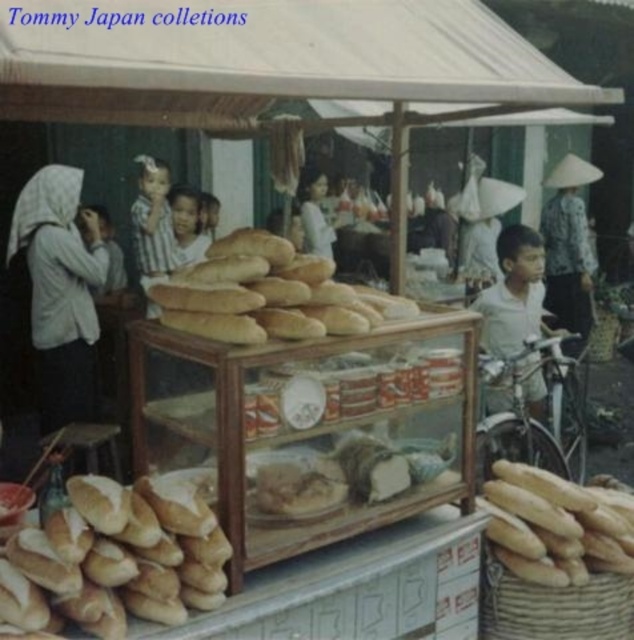
You are a customer at the bread stall and want to grab a baguette. Which one is easier to reach, the golden brown crusty baguette at lower left or the golden brown crusty baguettes at center?

The golden brown crusty baguette at lower left is closer to the viewer than the golden brown crusty baguettes at center, so it is easier to reach.

You are a fashion designer observing the Tommy Japan collections at the bread stall. You notice the white cloth headscarf at left and the white cotton shirt at center. Which item has a greater width?

The white cloth headscarf at left has a greater width than the white cotton shirt at center, as the description states its width surpasses the shirt.